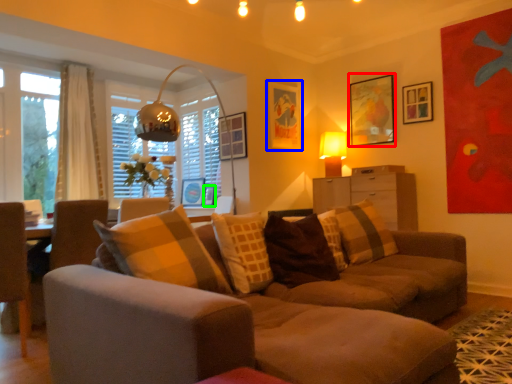
Question: Which object is positioned farthest from picture frame (highlighted by a red box)? Select from picture frame (highlighted by a blue box) and picture frame (highlighted by a green box).

Choices:
 (A) picture frame
 (B) picture frame

Answer: (B)